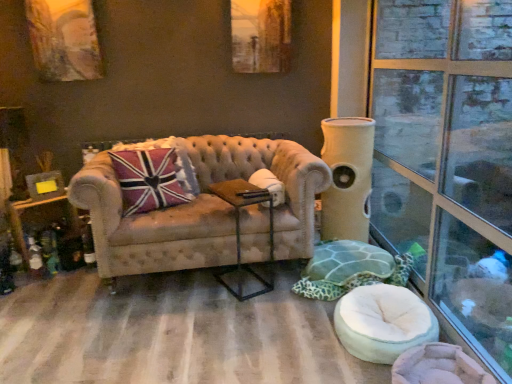
Question: Considering the positions of metallic brown side table at center and clear glass window at right in the image, is metallic brown side table at center wider or thinner than clear glass window at right?

Choices:
 (A) wide
 (B) thin

Answer: (A)

Question: Do you think metallic brown side table at center is within clear glass window at right, or outside of it?

Choices:
 (A) outside
 (B) inside

Answer: (A)

Question: Which is farther from the clear glass window at right?

Choices:
 (A) beige fabric cat tower at right
 (B) green fabric swivel chair at lower right, placed as the 2th swivel chair when sorted from front to back
 (C) white fabric swivel chair at lower right, placed as the second swivel chair when sorted from back to front
 (D) union jack fabric pillow at center
 (E) metallic brown side table at center

Answer: (D)

Question: Considering the real-world distances, which object is farthest from the tufted beige couch at center?

Choices:
 (A) clear glass window at right
 (B) green fabric swivel chair at lower right, placed as the 2th swivel chair when sorted from front to back
 (C) beige fabric cat tower at right
 (D) metallic brown side table at center
 (E) union jack fabric pillow at center

Answer: (A)